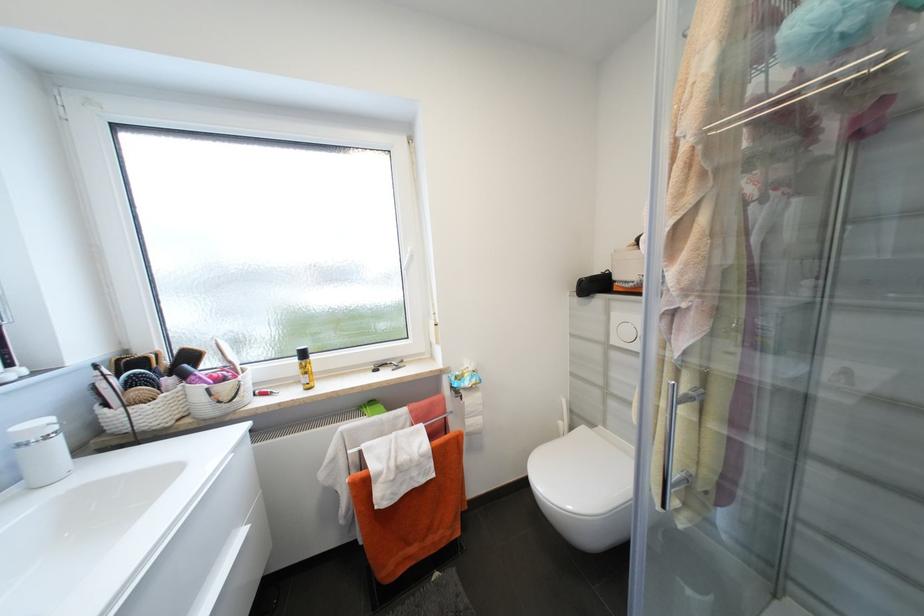
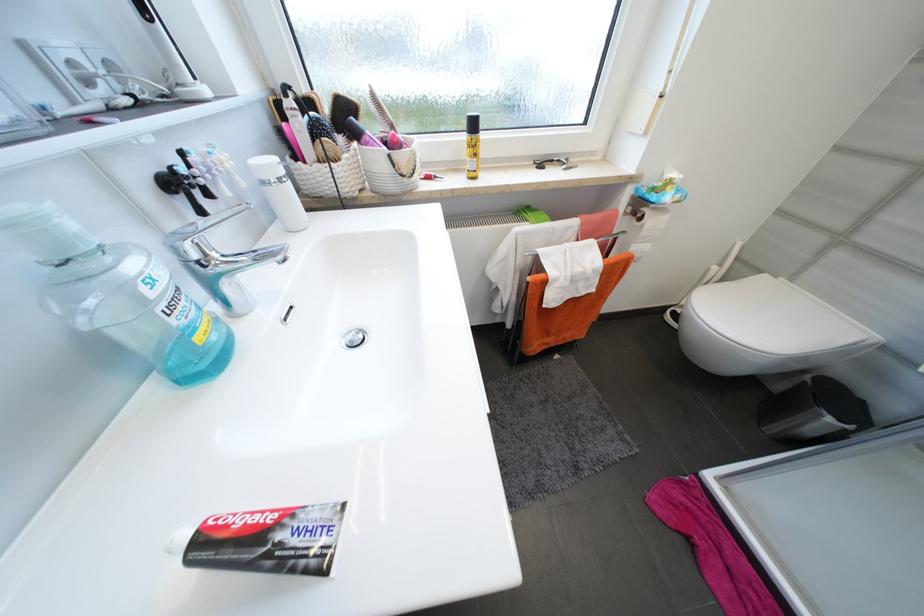
In the second image, find the point that corresponds to point (112, 406) in the first image.

(304, 158)